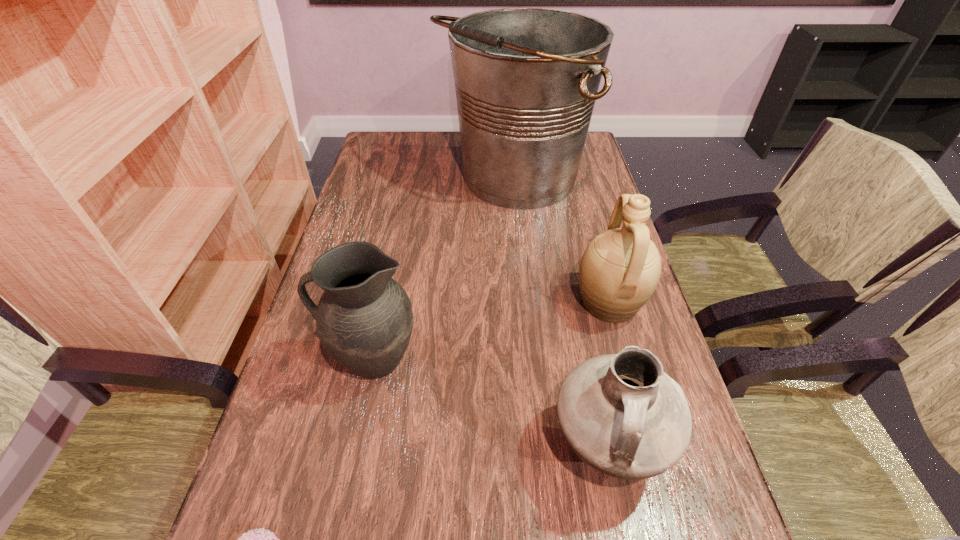
Where is `the tallest object`? The width and height of the screenshot is (960, 540). the tallest object is located at coordinates (526, 79).

Find the location of a particular element. The width and height of the screenshot is (960, 540). the farthest object is located at coordinates (526, 79).

In order to click on the leftmost pitcher in this screenshot , I will do `click(364, 319)`.

This screenshot has width=960, height=540. I want to click on vacant region located on the front of the tallest object, so click(524, 301).

Image resolution: width=960 pixels, height=540 pixels. Find the location of `object positioned at the far edge`. object positioned at the far edge is located at coordinates (526, 79).

Identify the location of object at the left edge. This screenshot has width=960, height=540. (x=364, y=319).

At what (x,y) coordinates should I click in order to perform the action: click on bucket that is at the right edge. Please return your answer as a coordinate pair (x, y). The height and width of the screenshot is (540, 960). Looking at the image, I should click on (526, 79).

Find the location of a particular element. The image size is (960, 540). object that is at the far right corner is located at coordinates (526, 79).

Locate an element on the screen. This screenshot has width=960, height=540. free region at the far edge of the desktop is located at coordinates (429, 133).

Image resolution: width=960 pixels, height=540 pixels. I want to click on free region at the right edge, so click(x=580, y=207).